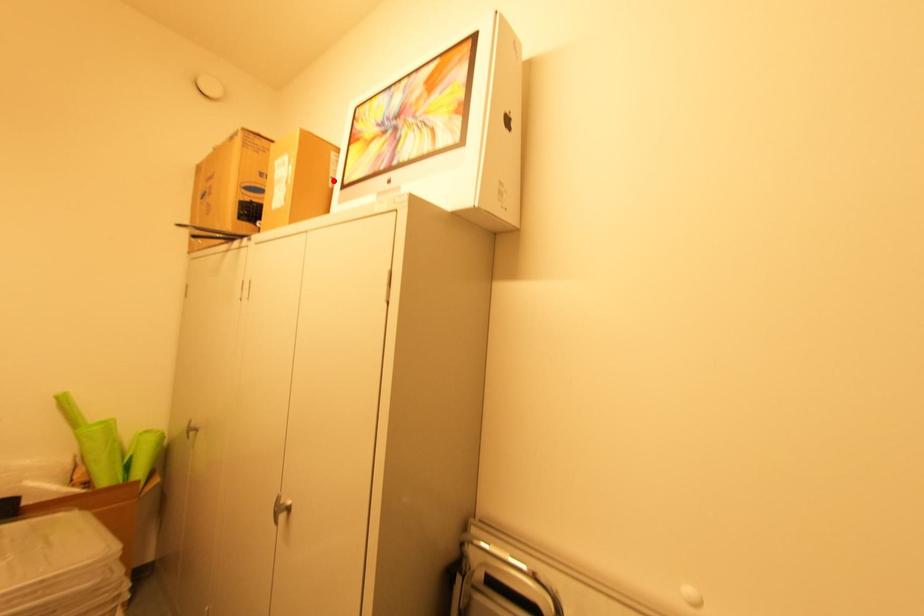
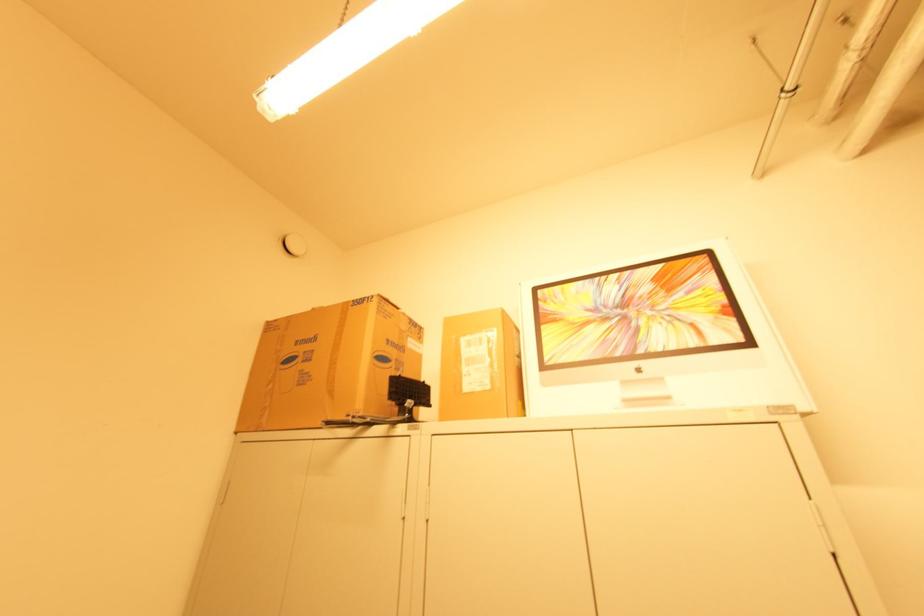
In the second image, find the point that corresponds to the highlighted location in the first image.

(520, 359)